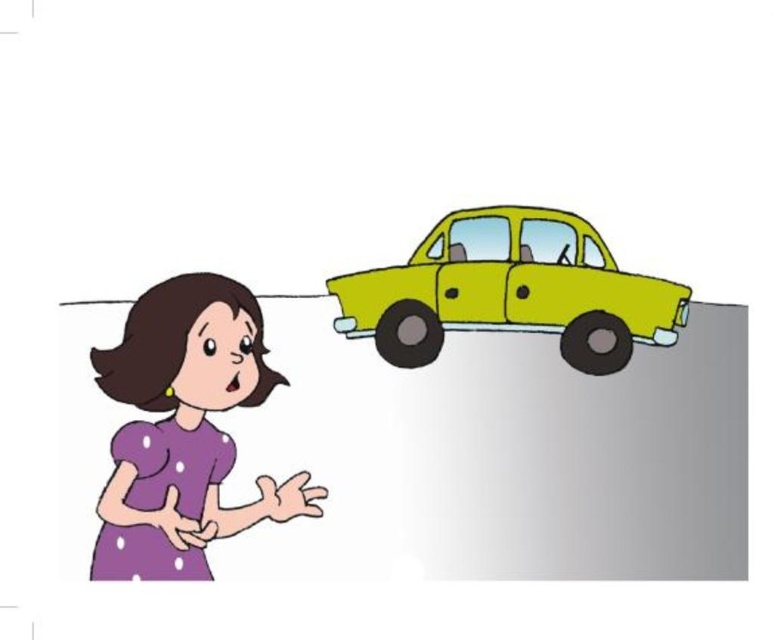
Is purple dotted dress at lower left wider than yellow matte car at upper right?

No, purple dotted dress at lower left is not wider than yellow matte car at upper right.

Is purple dotted dress at lower left to the right of yellow matte car at upper right from the viewer's perspective?

No, purple dotted dress at lower left is not to the right of yellow matte car at upper right.

Does point (204, 461) come closer to viewer compared to point (466, 253)?

Yes, point (204, 461) is closer to viewer.

This screenshot has height=640, width=774. In order to click on purple dotted dress at lower left in this screenshot , I will do `click(183, 429)`.